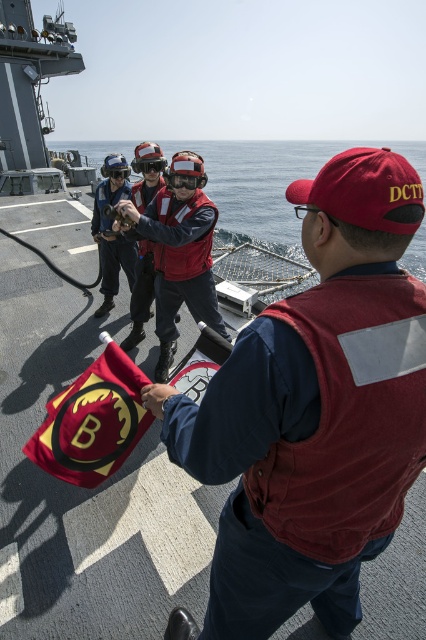
Question: Is blue water at center closer to camera compared to matte red life vest at center?

Choices:
 (A) no
 (B) yes

Answer: (A)

Question: Is blue water at center positioned behind red fabric flag at center?

Choices:
 (A) yes
 (B) no

Answer: (A)

Question: Which object is the farthest from the matte red life vest at center?

Choices:
 (A) red fabric flag at center
 (B) blue water at center

Answer: (B)

Question: Which object appears closest to the camera in this image?

Choices:
 (A) blue water at center
 (B) red fabric flag at center

Answer: (B)

Question: Which point is closer to the camera?

Choices:
 (A) blue water at center
 (B) matte red life vest at center
 (C) red fabric flag at center

Answer: (C)

Question: Is red fabric flag at center smaller than matte red life vest at center?

Choices:
 (A) no
 (B) yes

Answer: (B)